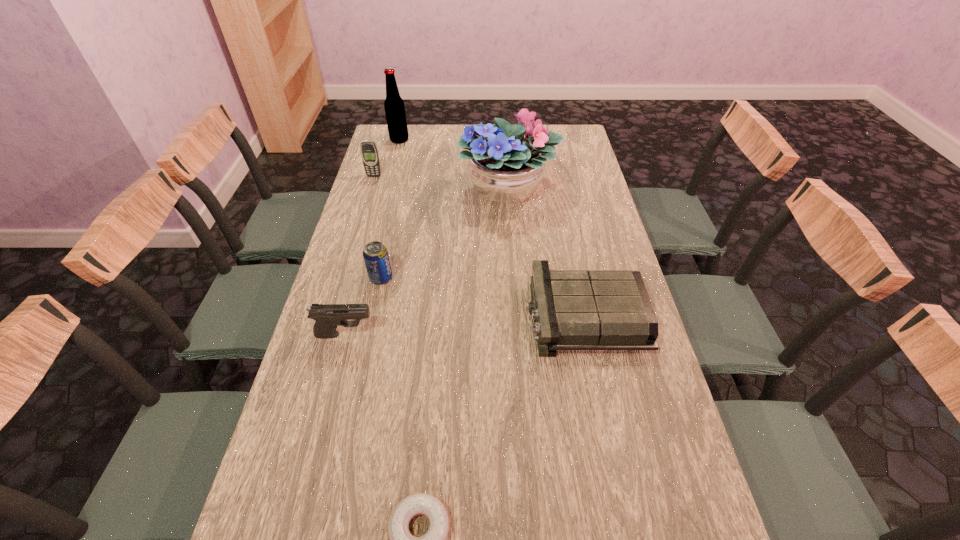
Where is `vacant space located at the barrel of the pistol`? The width and height of the screenshot is (960, 540). vacant space located at the barrel of the pistol is located at coordinates (473, 334).

You are a GUI agent. You are given a task and a screenshot of the screen. Output one action in this format:
    pyautogui.click(x=<x>, y=<y>)
    Task: Click on the free region located on the front panel of the radio receiver
    The width and height of the screenshot is (960, 540).
    Given the screenshot: What is the action you would take?
    pyautogui.click(x=401, y=316)

Locate an element on the screen. The image size is (960, 540). free location located 0.080m on the front panel of the radio receiver is located at coordinates (499, 316).

Where is `blank space located on the front panel of the radio receiver`? Image resolution: width=960 pixels, height=540 pixels. blank space located on the front panel of the radio receiver is located at coordinates (430, 316).

Locate an element on the screen. object situated at the far edge is located at coordinates (394, 105).

At what (x,y) coordinates should I click in order to perform the action: click on beer bottle at the left edge. Please return your answer as a coordinate pair (x, y). Image resolution: width=960 pixels, height=540 pixels. Looking at the image, I should click on (394, 105).

At what (x,y) coordinates should I click in order to perform the action: click on cellular telephone located in the left edge section of the desktop. Please return your answer as a coordinate pair (x, y). Looking at the image, I should click on (369, 152).

Locate an element on the screen. The image size is (960, 540). soda that is positioned at the left edge is located at coordinates (375, 254).

Where is `pistol at the left edge`? pistol at the left edge is located at coordinates (327, 316).

At what (x,y) coordinates should I click in order to perform the action: click on bouquet that is at the right edge. Please return your answer as a coordinate pair (x, y). The height and width of the screenshot is (540, 960). Looking at the image, I should click on (505, 167).